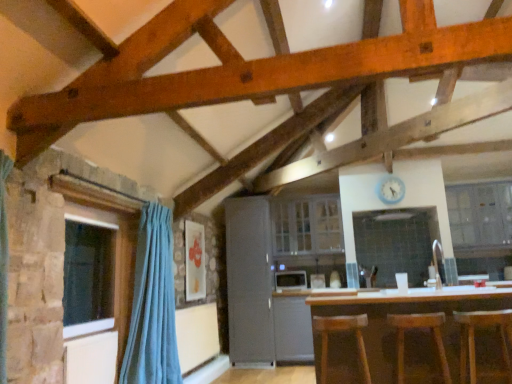
Question: Relative to teal fabric curtain at left, is white glossy cabinet at center, which is the 2th cabinetry in right-to-left order, in front or behind?

Choices:
 (A) front
 (B) behind

Answer: (B)

Question: Is white glossy cabinet at center, which is the first cabinetry in left-to-right order, wider or thinner than teal fabric curtain at left?

Choices:
 (A) thin
 (B) wide

Answer: (A)

Question: Which is nearer to the metallic silver microwave at center, the 1th appliance in the right-to-left sequence?

Choices:
 (A) satin silver microwave at center, which is the second appliance from right to left
 (B) white glossy cabinet at center, which is the first cabinetry in left-to-right order
 (C) brown wooden table at center
 (D) white glossy cabinet at upper center, marked as the 1th cabinetry in a right-to-left arrangement
 (E) white glossy sink at center

Answer: (A)

Question: Estimate the real-world distances between objects in this image. Which object is farther from the satin silver microwave at center, which is the second appliance from right to left?

Choices:
 (A) white glossy sink at center
 (B) white glossy cabinet at upper center, the 2th cabinetry in the left-to-right sequence
 (C) satin grey refrigerator at center
 (D) brown wooden table at center
 (E) brown wooden bar stool at lower right, which is counted as the 1th bar stool, starting from the right

Answer: (E)